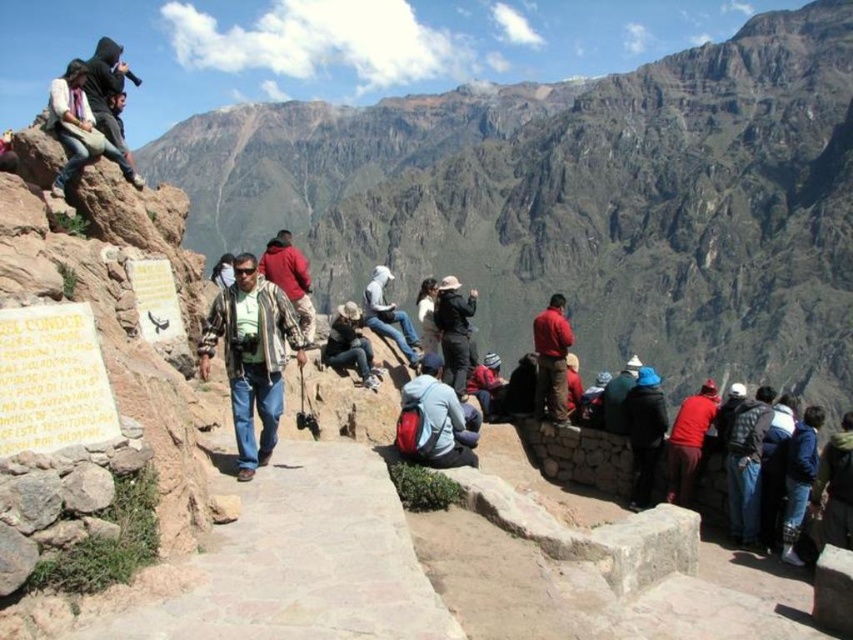
You are a photographer at the viewpoint overlooking the Colca Canyon. You need to capture a photo that includes both the dark blue jacket at center and the blue denim jacket at lower right. Which jacket will appear bigger in the final photo?

The dark blue jacket at center will appear bigger in the photo because it is larger in size than the blue denim jacket at lower right.

You are a photographer planning to take a photo of the dark blue jacket at center from the viewpoint overlooking the Colca Canyon. What are the coordinates where you should aim your camera?

The dark blue jacket at center is located at coordinates point [643,433].